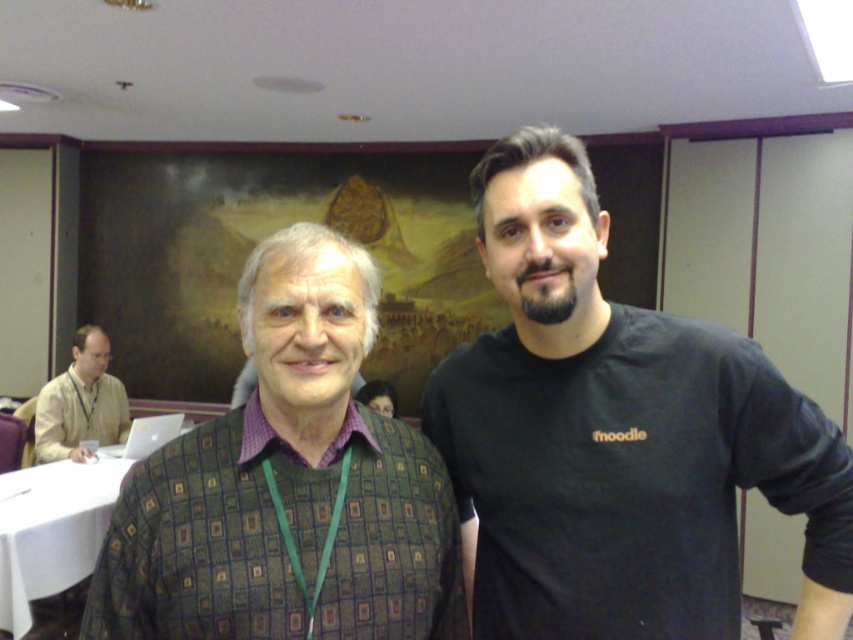
Question: Can you confirm if black matte shirt at center is positioned to the right of purple woven shirt at center?

Choices:
 (A) yes
 (B) no

Answer: (A)

Question: Does black matte shirt at center come behind purple woven shirt at center?

Choices:
 (A) no
 (B) yes

Answer: (B)

Question: Which is nearer to the black matte shirt at center?

Choices:
 (A) purple woven shirt at center
 (B) beige fabric shirt at left

Answer: (A)

Question: Estimate the real-world distances between objects in this image. Which object is closer to the green textured sweater at center?

Choices:
 (A) beige fabric shirt at left
 (B) black matte shirt at center
 (C) purple woven shirt at center

Answer: (C)

Question: Which object is closer to the camera taking this photo?

Choices:
 (A) beige fabric shirt at left
 (B) purple woven shirt at center

Answer: (B)

Question: Is green textured sweater at center positioned behind purple woven shirt at center?

Choices:
 (A) no
 (B) yes

Answer: (A)